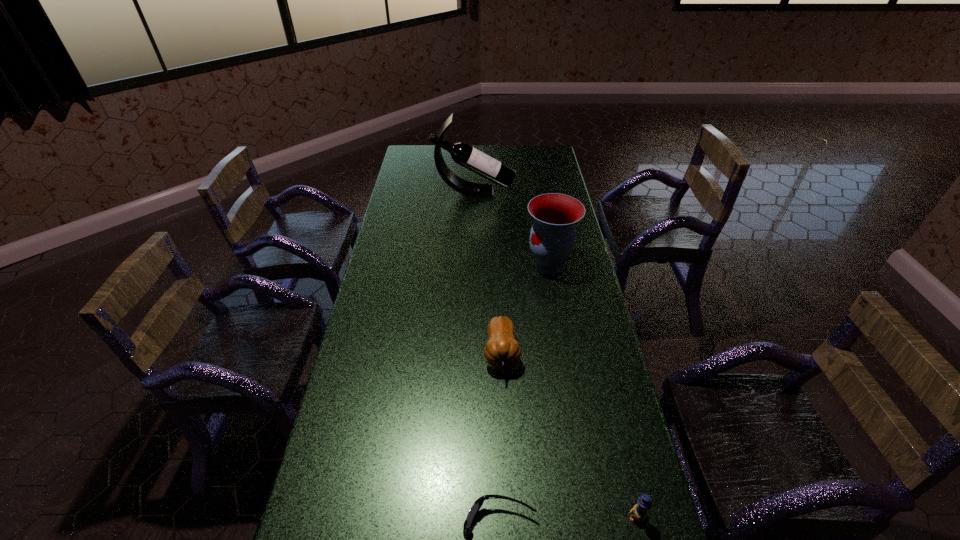
Find the location of a particular element. the farthest object is located at coordinates coord(463,154).

Locate an element on the screen. The image size is (960, 540). the tallest object is located at coordinates (463, 154).

This screenshot has height=540, width=960. What are the coordinates of `the fourth nearest object` in the screenshot? It's located at (552, 238).

The width and height of the screenshot is (960, 540). I want to click on the fourth shortest object, so click(552, 238).

Locate an element on the screen. gourd is located at coordinates (502, 352).

Image resolution: width=960 pixels, height=540 pixels. In order to click on the second shortest object in this screenshot , I will do `click(639, 512)`.

This screenshot has width=960, height=540. Find the location of `blank space located on the stand of the tallest object`. blank space located on the stand of the tallest object is located at coordinates (551, 192).

This screenshot has width=960, height=540. What are the coordinates of `vacant space located on the front of the vase` in the screenshot? It's located at (556, 305).

Locate an element on the screen. vacant space located on the stem side of the third farthest object is located at coordinates (509, 524).

Image resolution: width=960 pixels, height=540 pixels. I want to click on vase that is at the right edge, so click(552, 238).